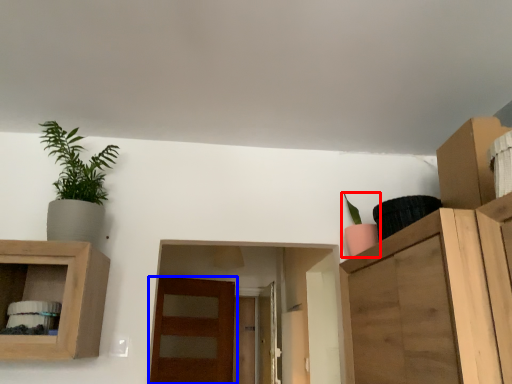
Question: Which of the following is the closest to the observer, houseplant (highlighted by a red box) or door (highlighted by a blue box)?

Choices:
 (A) houseplant
 (B) door

Answer: (A)